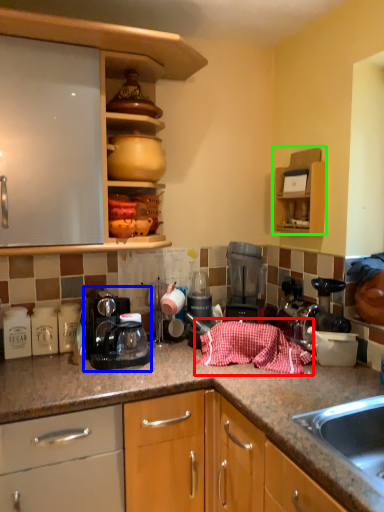
Question: Considering the real-world distances, which object is closest to blanket (highlighted by a red box)? home appliance (highlighted by a blue box) or cabinetry (highlighted by a green box).

Choices:
 (A) home appliance
 (B) cabinetry

Answer: (A)